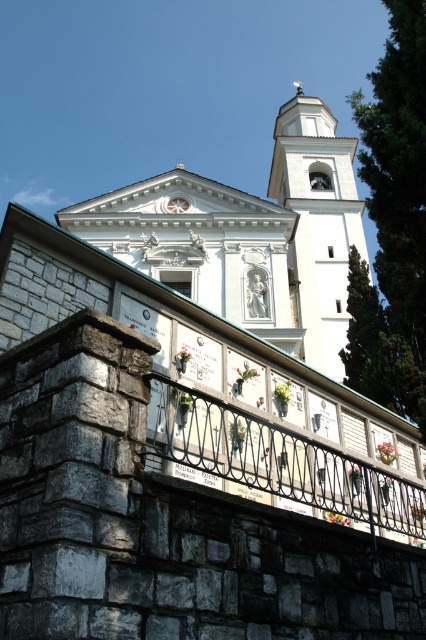
You are standing at the base of the white stone bell tower at upper center and want to see over the black wrought iron railing at center to view the plaques behind. Can you see over the railing?

The black wrought iron railing at center is shorter than the white stone bell tower at upper center, so yes, you can see over the black wrought iron railing at center from the base of the white stone bell tower at upper center.